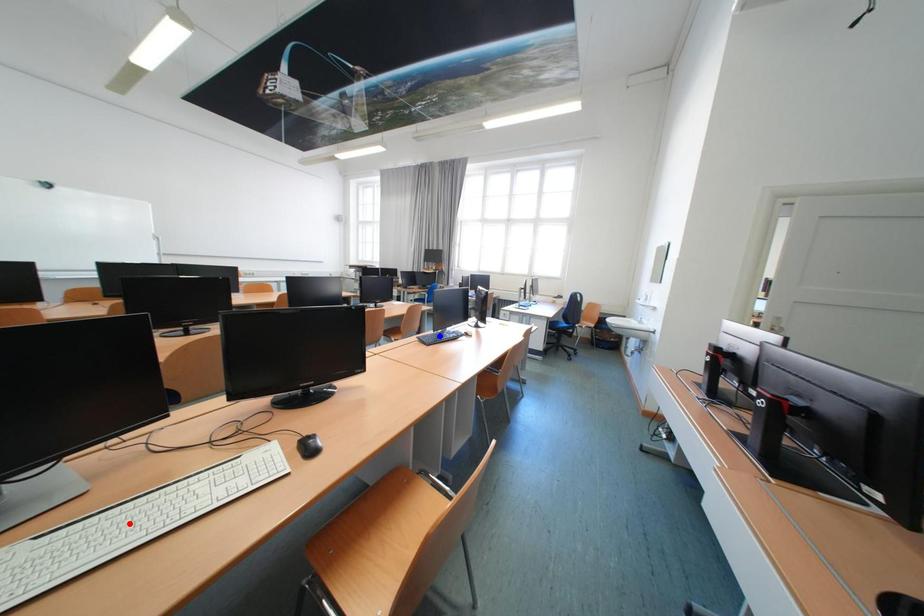
Question: Which of the two points in the image is closer to the camera?

Choices:
 (A) Blue point is closer.
 (B) Red point is closer.

Answer: (B)